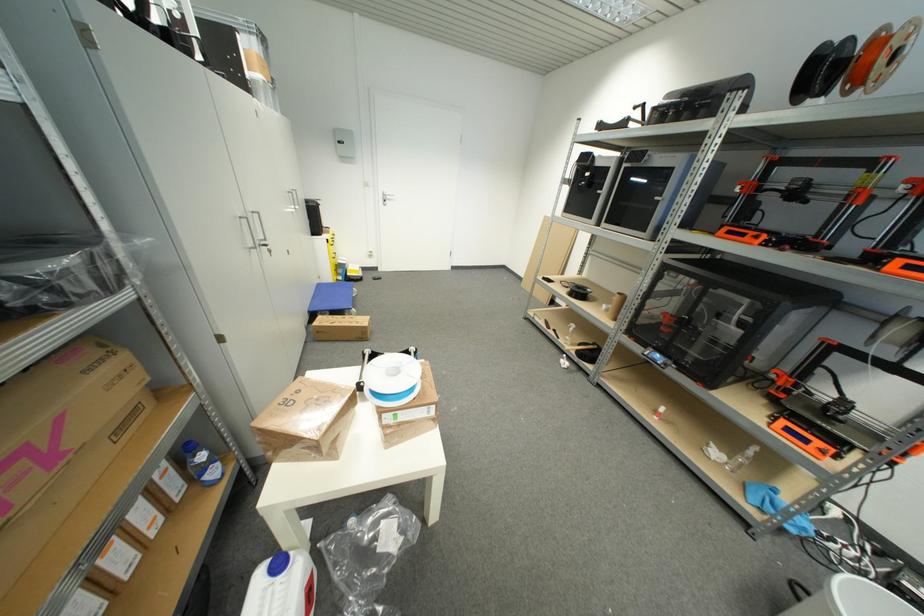
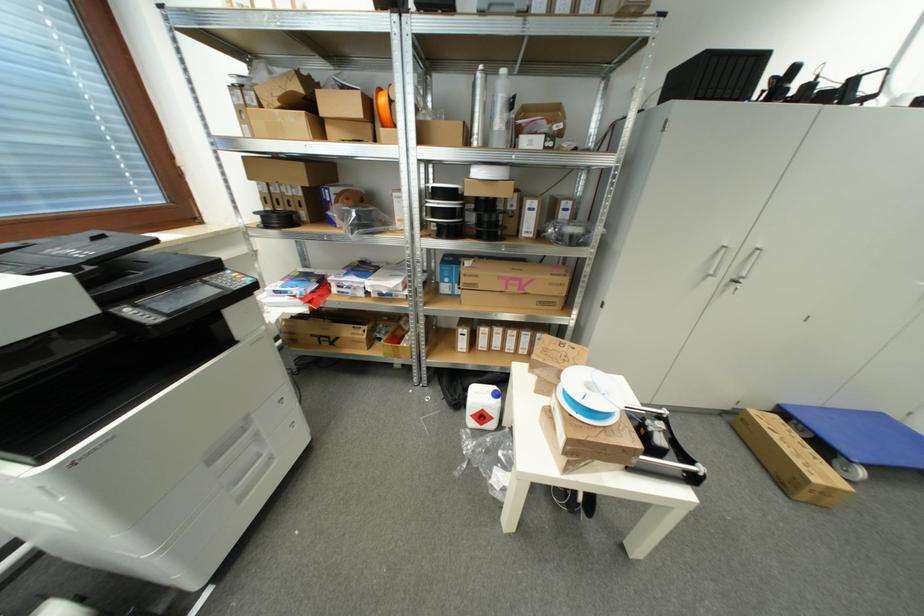
In the second image, find the point that corresponds to (x=322, y=286) in the first image.

(885, 418)